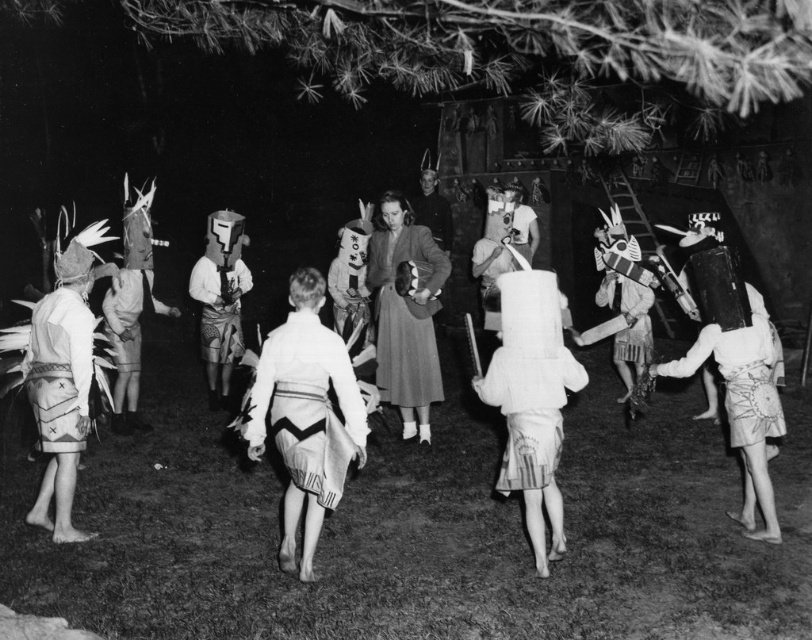
Question: Is matte gray coat at center above white fabric skirt at lower right?

Choices:
 (A) yes
 (B) no

Answer: (A)

Question: Which point is closer to the camera taking this photo?

Choices:
 (A) (42, 301)
 (B) (292, 324)
 (C) (415, 333)

Answer: (B)

Question: Does patterned fabric headdress at center appear over smooth leather jacket at center?

Choices:
 (A) no
 (B) yes

Answer: (A)

Question: Which of the following is the farthest from the observer?

Choices:
 (A) (273, 432)
 (B) (68, 362)
 (C) (685, 365)
 (D) (422, 184)

Answer: (D)

Question: Which point appears farthest from the camera in this image?

Choices:
 (A) (63, 291)
 (B) (767, 381)

Answer: (A)

Question: Does white fabric skirt at lower right appear under patterned fabric headdress at center?

Choices:
 (A) yes
 (B) no

Answer: (A)